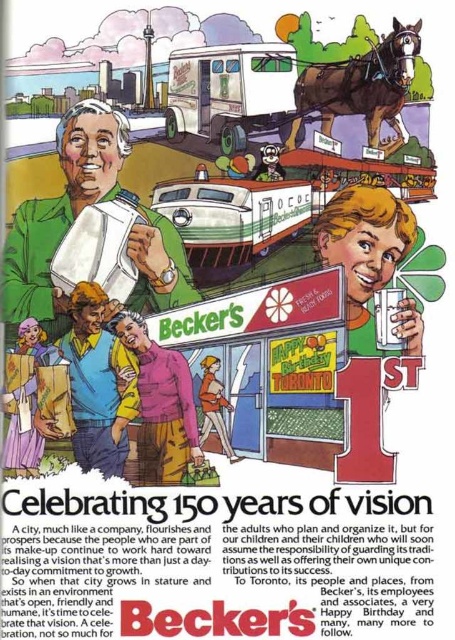
Question: Can you confirm if green fabric shirt at upper left is wider than orange fabric jacket at center?

Choices:
 (A) yes
 (B) no

Answer: (A)

Question: Which object is the farthest from the green fabric shirt at upper left?

Choices:
 (A) smooth plastic cup at center
 (B) orange fabric jacket at center
 (C) pink fabric shirt at center
 (D) pastel pink fabric at lower left

Answer: (A)

Question: Does smooth plastic cup at center have a greater width compared to orange fabric jacket at center?

Choices:
 (A) no
 (B) yes

Answer: (B)

Question: In this image, where is smooth plastic cup at center located relative to pastel pink fabric at lower left?

Choices:
 (A) above
 (B) below

Answer: (A)

Question: Among these objects, which one is nearest to the camera?

Choices:
 (A) orange fabric jacket at center
 (B) smooth plastic cup at center

Answer: (A)

Question: Which object appears farthest from the camera in this image?

Choices:
 (A) green fabric shirt at upper left
 (B) pink fabric shirt at center
 (C) pastel pink fabric at lower left

Answer: (A)